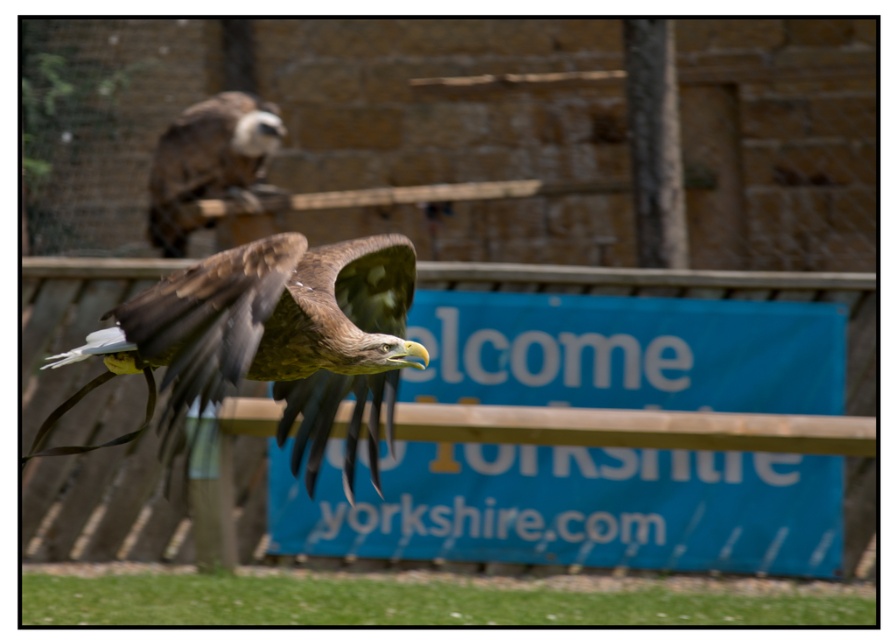
Question: Which of the following is the closest to the observer?

Choices:
 (A) (171, 420)
 (B) (225, 160)

Answer: (A)

Question: Is brown feathered eagle at center positioned behind brown feathered eagle at upper center?

Choices:
 (A) yes
 (B) no

Answer: (B)

Question: Which point is closer to the camera?

Choices:
 (A) (307, 308)
 (B) (228, 164)

Answer: (A)

Question: Can you confirm if brown feathered eagle at center is wider than brown feathered eagle at upper center?

Choices:
 (A) yes
 (B) no

Answer: (A)

Question: Can you confirm if brown feathered eagle at center is bigger than brown feathered eagle at upper center?

Choices:
 (A) yes
 (B) no

Answer: (A)

Question: Which of the following is the farthest from the observer?

Choices:
 (A) (259, 109)
 (B) (291, 324)

Answer: (A)